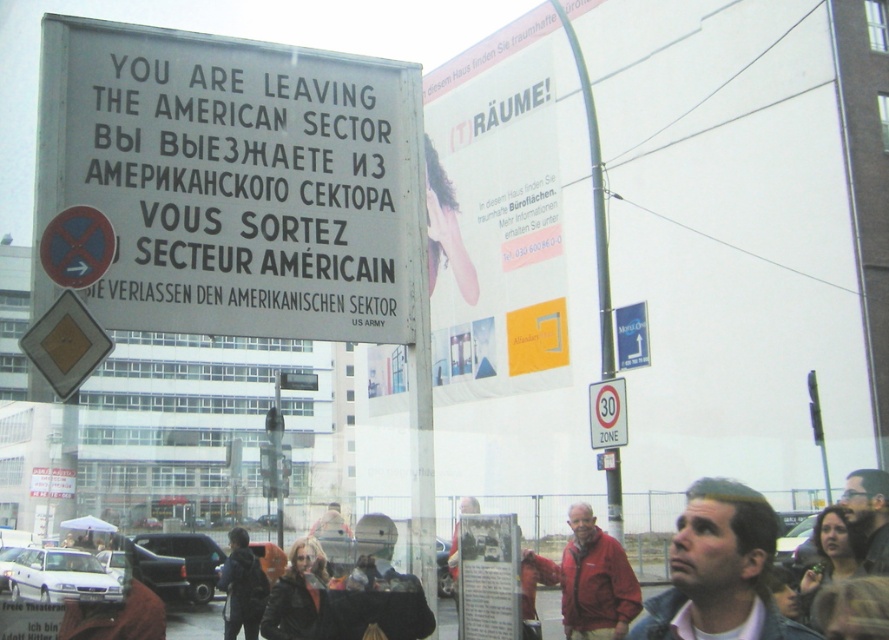
Who is lower down, gray hair at upper center or metallic pole at center-right?

Positioned lower is gray hair at upper center.

Between point (695, 522) and point (610, 324), which one is positioned behind?

Point (610, 324)

Where is `gray hair at upper center`? The image size is (889, 640). gray hair at upper center is located at coordinates pyautogui.click(x=719, y=566).

The height and width of the screenshot is (640, 889). I want to click on gray hair at upper center, so click(x=719, y=566).

Who is positioned more to the right, white plastic sign at upper left or gray hair at upper center?

gray hair at upper center

Is point (124, 42) in front of point (713, 634)?

No, (124, 42) is behind (713, 634).

Describe the element at coordinates (237, 180) in the screenshot. I see `white plastic sign at upper left` at that location.

This screenshot has height=640, width=889. I want to click on white plastic sign at upper left, so click(x=237, y=180).

Who is shorter, dark brown leather jacket at lower right or metallic rectangular speed limit sign at right?

metallic rectangular speed limit sign at right

Based on the photo, measure the distance between dark brown leather jacket at lower right and metallic rectangular speed limit sign at right.

dark brown leather jacket at lower right and metallic rectangular speed limit sign at right are 6.71 meters apart from each other.

Is point (839, 508) closer to viewer compared to point (606, 412)?

Yes, point (839, 508) is in front of point (606, 412).

Locate an element on the screen. This screenshot has width=889, height=640. dark brown leather jacket at lower right is located at coordinates (829, 556).